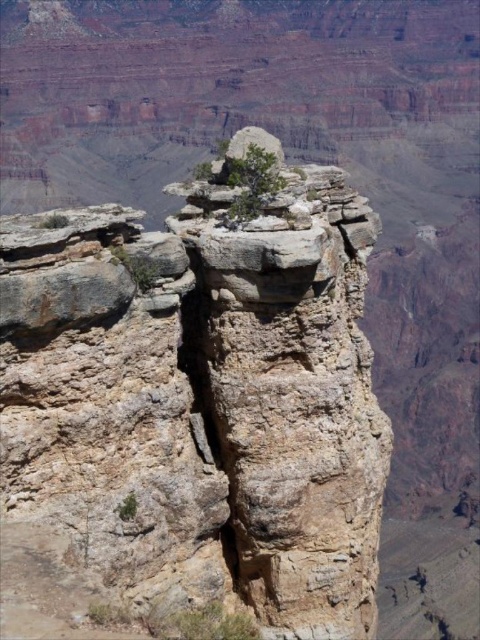
You are a hiker who wants to cross between the rusty stone rock formation at center and the green matte tree at center. The path between them is narrow and unstable. Can you safely cross the 6.46 meters gap between them?

The distance between the rusty stone rock formation at center and the green matte tree at center is 6.46 meters. Since the path is narrow and unstable, it is not safe to cross the gap of 6.46 meters.

You are a geologist examining the Grand Canyon landscape. You notice the rusty stone rock formation at center and the green matte tree at center. Which object would you estimate to be bigger in size?

The rusty stone rock formation at center has a larger size compared to the green matte tree at center, so the rusty stone rock formation at center is bigger.